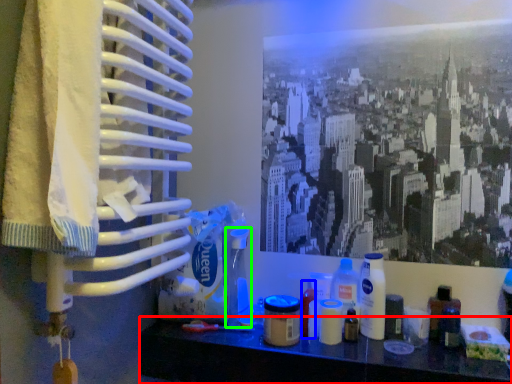
Question: Based on their relative distances, which object is farther from furniture (highlighted by a red box)? Choose from toiletry (highlighted by a blue box) and toiletry (highlighted by a green box).

Choices:
 (A) toiletry
 (B) toiletry

Answer: (B)